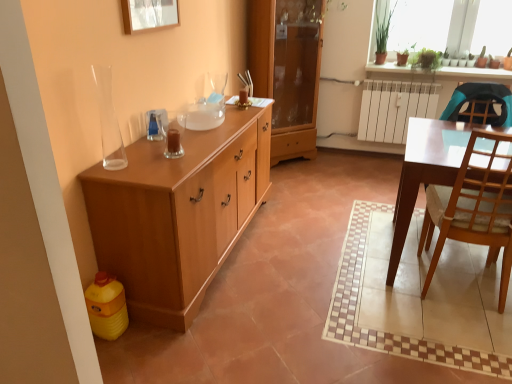
The height and width of the screenshot is (384, 512). In order to click on unoccupied area in front of transparent glass vase at upper left in this screenshot , I will do `click(112, 170)`.